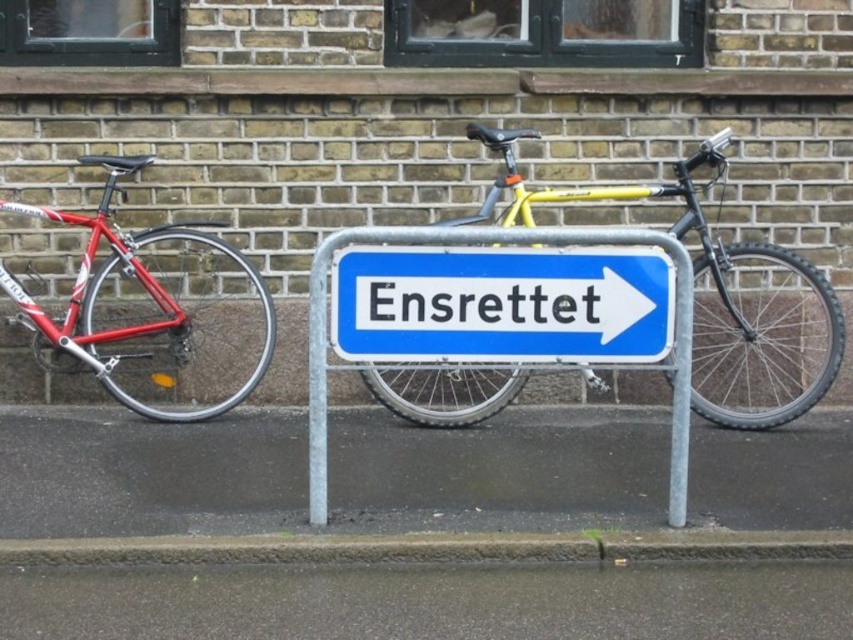
You are a delivery person with a package that requires a 2.5 meter clearance to maneuver around the shiny red bicycle at left and the blue metallic sign at center. Is there enough space to navigate between them?

The shiny red bicycle at left is 1.82 meters from the blue metallic sign at center. Since the required clearance is 2.5 meters, there is insufficient space to maneuver between them.